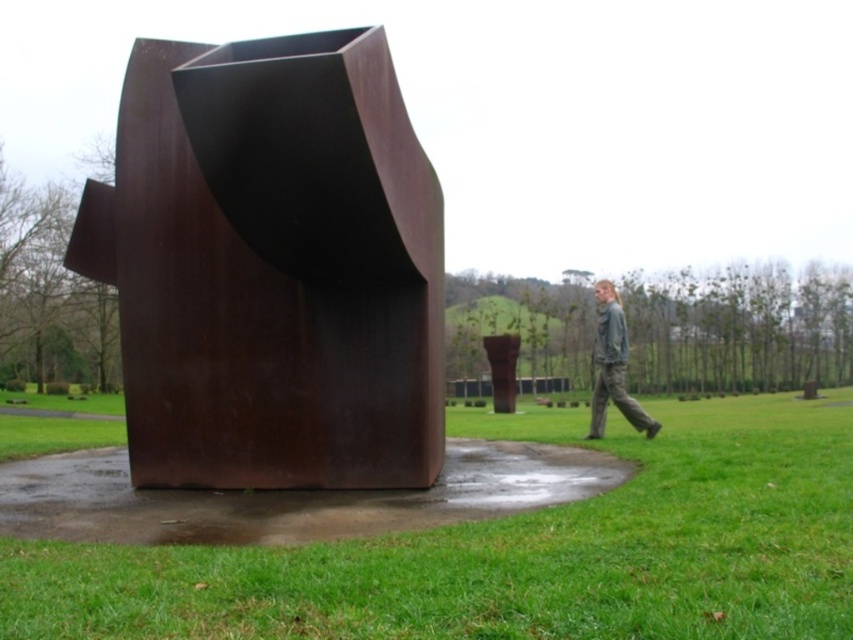
Question: Does green grass at lower center appear under gray cotton pants at lower right?

Choices:
 (A) no
 (B) yes

Answer: (B)

Question: Where is rusty metal sculpture at center located in relation to green grass at lower center in the image?

Choices:
 (A) below
 (B) above

Answer: (B)

Question: Which object is the closest to the gray cotton pants at lower right?

Choices:
 (A) green grass at lower center
 (B) rusty metal sculpture at center

Answer: (A)

Question: Which of these objects is positioned closest to the gray cotton pants at lower right?

Choices:
 (A) rusty metal sculpture at center
 (B) green grass at lower center

Answer: (B)

Question: Is rusty metal sculpture at center positioned before green grass at lower center?

Choices:
 (A) yes
 (B) no

Answer: (B)

Question: Which object is the closest to the gray cotton pants at lower right?

Choices:
 (A) rusty metal sculpture at center
 (B) green grass at lower center

Answer: (B)